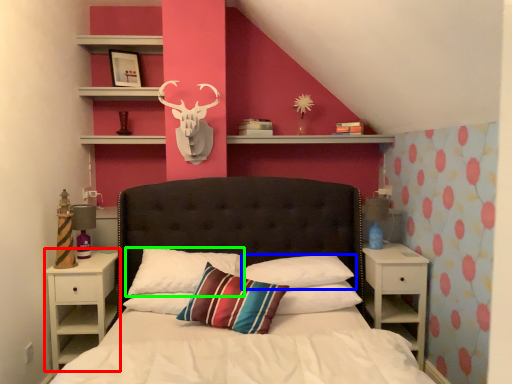
Question: Based on their relative distances, which object is nearer to nightstand (highlighted by a red box)? Choose from pillow (highlighted by a blue box) and pillow (highlighted by a green box).

Choices:
 (A) pillow
 (B) pillow

Answer: (B)